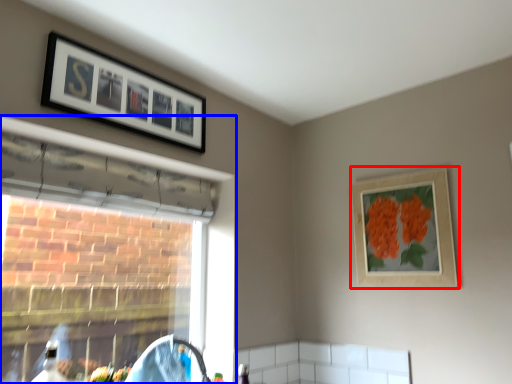
Question: Which object is closer to the camera taking this photo, picture frame (highlighted by a red box) or window (highlighted by a blue box)?

Choices:
 (A) picture frame
 (B) window

Answer: (B)